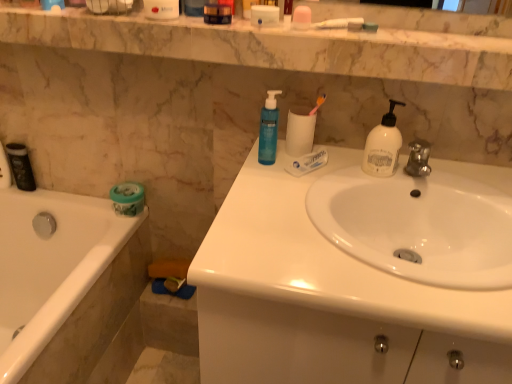
The height and width of the screenshot is (384, 512). I want to click on free space in front of blue translucent pump bottle at upper center, the 2th soap dispenser positioned from the right, so click(270, 192).